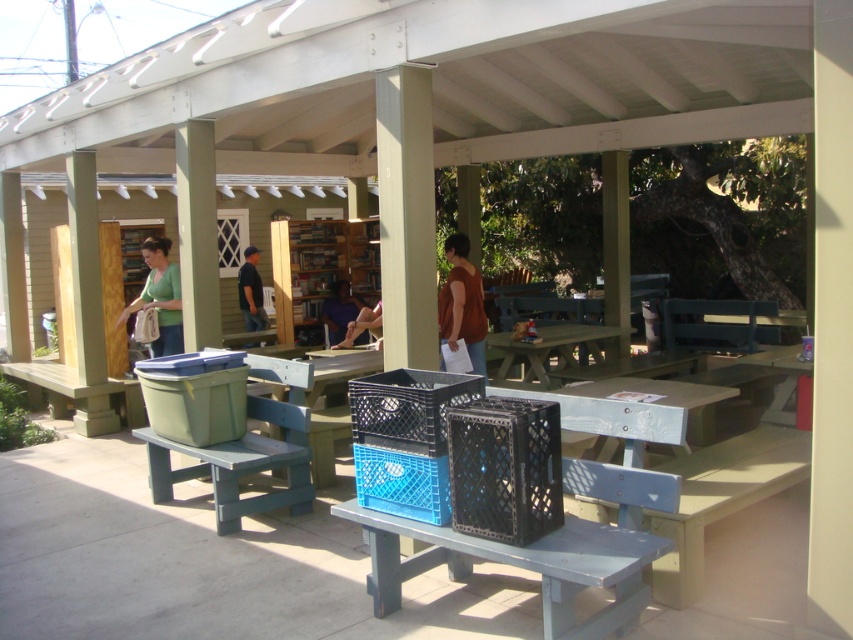
Question: Where is matte plastic bench at lower left located in relation to matte purple shirt at center in the image?

Choices:
 (A) left
 (B) right

Answer: (A)

Question: Among these points, which one is nearest to the camera?

Choices:
 (A) 256,272
 (B) 456,308

Answer: (B)

Question: Considering the relative positions of blue plastic table at center and matte green shirt at center in the image provided, where is blue plastic table at center located with respect to matte green shirt at center?

Choices:
 (A) below
 (B) above

Answer: (A)

Question: Which object appears farthest from the camera in this image?

Choices:
 (A) blue plastic bench at center
 (B) brown leather jacket at center
 (C) green painted wood bench at left

Answer: (B)

Question: Which point appears farthest from the camera in this image?

Choices:
 (A) (378, 538)
 (B) (256, 316)
 (C) (682, 566)

Answer: (B)

Question: Is matte green shirt at center wider than brown leather jacket at center?

Choices:
 (A) no
 (B) yes

Answer: (B)